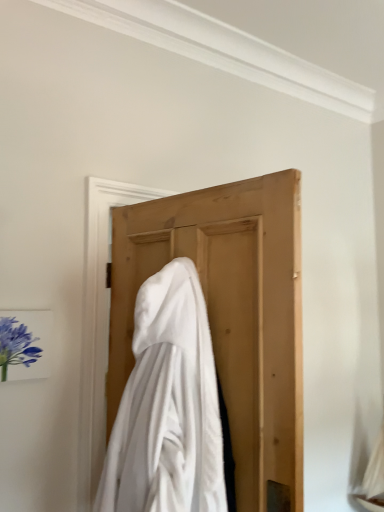
Describe the element at coordinates (167, 406) in the screenshot. I see `white soft cloth at center` at that location.

Locate an element on the screen. This screenshot has width=384, height=512. white soft cloth at center is located at coordinates point(167,406).

The height and width of the screenshot is (512, 384). What do you see at coordinates (17, 344) in the screenshot? I see `matte purple flower at left` at bounding box center [17, 344].

Where is `matte purple flower at left`? The image size is (384, 512). matte purple flower at left is located at coordinates (x=17, y=344).

Locate an element on the screen. The width and height of the screenshot is (384, 512). white soft cloth at center is located at coordinates (167, 406).

Would you say white soft cloth at center is to the left or to the right of matte purple flower at left in the picture?

Clearly, white soft cloth at center is on the right of matte purple flower at left in the image.

Does white soft cloth at center come behind matte purple flower at left?

That is False.

Does point (123, 413) lie behind point (10, 361)?

No, (123, 413) is closer to viewer.

From the image's perspective, which object appears higher, white soft cloth at center or matte purple flower at left?

matte purple flower at left, from the image's perspective.

From a real-world perspective, is white soft cloth at center physically located above or below matte purple flower at left?

white soft cloth at center is below matte purple flower at left.

In terms of width, does white soft cloth at center look wider or thinner when compared to matte purple flower at left?

In the image, white soft cloth at center appears to be wider than matte purple flower at left.

Consider the image. Considering the sizes of white soft cloth at center and matte purple flower at left in the image, is white soft cloth at center taller or shorter than matte purple flower at left?

Considering their sizes, white soft cloth at center has more height than matte purple flower at left.

Considering the relative sizes of white soft cloth at center and matte purple flower at left in the image provided, is white soft cloth at center bigger than matte purple flower at left?

Correct, white soft cloth at center is larger in size than matte purple flower at left.

Is white soft cloth at center located outside matte purple flower at left?

white soft cloth at center lies outside matte purple flower at left's area.

Is the surface of white soft cloth at center in direct contact with matte purple flower at left?

No, white soft cloth at center is not touching matte purple flower at left.

Is white soft cloth at center oriented towards matte purple flower at left?

No, white soft cloth at center is not aimed at matte purple flower at left.

Locate an element on the screen. flower that is behind the white soft cloth at center is located at coordinates (17, 344).

Which object is positioned more to the left, matte purple flower at left or white soft cloth at center?

From the viewer's perspective, matte purple flower at left appears more on the left side.

Between matte purple flower at left and white soft cloth at center, which one is positioned behind?

matte purple flower at left is further from the camera.

Does point (27, 327) appear closer or farther from the camera than point (105, 471)?

Clearly, point (27, 327) is more distant from the camera than point (105, 471).

From the image's perspective, is matte purple flower at left located above or below white soft cloth at center?

Clearly, from the image's perspective, matte purple flower at left is above white soft cloth at center.

From a real-world perspective, between matte purple flower at left and white soft cloth at center, who is vertically lower?

white soft cloth at center.

Considering the sizes of matte purple flower at left and white soft cloth at center in the image, is matte purple flower at left wider or thinner than white soft cloth at center?

Clearly, matte purple flower at left has less width compared to white soft cloth at center.

Is matte purple flower at left shorter than white soft cloth at center?

Correct, matte purple flower at left is not as tall as white soft cloth at center.

Which of these two, matte purple flower at left or white soft cloth at center, is bigger?

white soft cloth at center is bigger.

Could white soft cloth at center be considered to be inside matte purple flower at left?

No, matte purple flower at left does not contain white soft cloth at center.

Is there a large distance between matte purple flower at left and white soft cloth at center?

Actually, matte purple flower at left and white soft cloth at center are a little close together.

Is matte purple flower at left turned away from white soft cloth at center?

That's not correct — matte purple flower at left is not looking away from white soft cloth at center.

What's the angular difference between matte purple flower at left and white soft cloth at center's facing directions?

The facing directions of matte purple flower at left and white soft cloth at center are 78.4 degrees apart.

The width and height of the screenshot is (384, 512). What are the coordinates of `flower that appears behind the white soft cloth at center` in the screenshot? It's located at (17, 344).

Image resolution: width=384 pixels, height=512 pixels. Find the location of `cloak that is below the matte purple flower at left (from the image's perspective)`. cloak that is below the matte purple flower at left (from the image's perspective) is located at coordinates (167, 406).

The image size is (384, 512). I want to click on flower on the left of the white soft cloth at center, so click(17, 344).